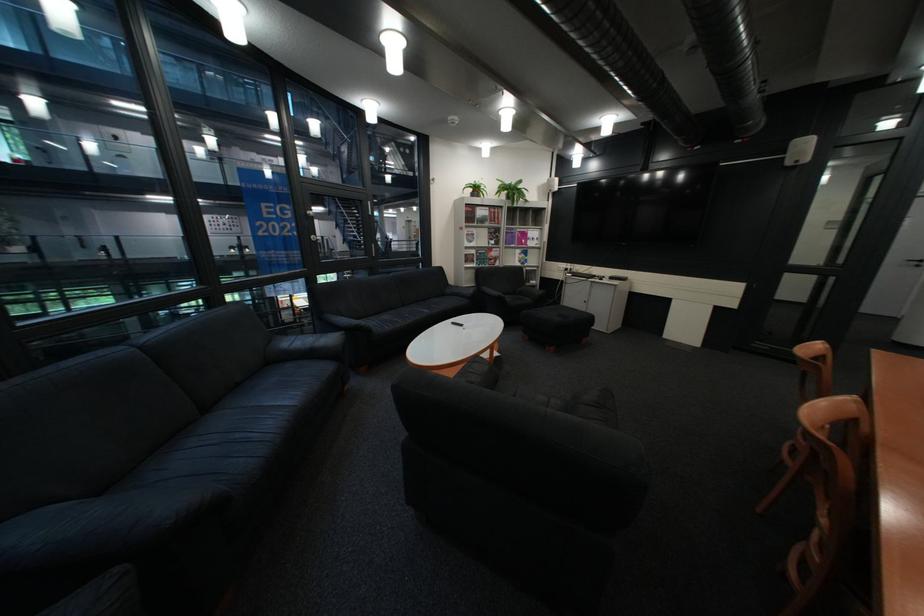
What are the coordinates of `wooden chair sitting surface` in the screenshot? It's located at (862, 519).